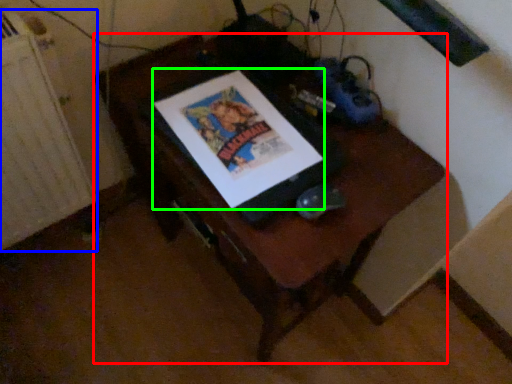
Question: Based on their relative distances, which object is farther from furniture (highlighted by a red box)? Choose from radiator (highlighted by a blue box) and comic book (highlighted by a green box).

Choices:
 (A) radiator
 (B) comic book

Answer: (A)